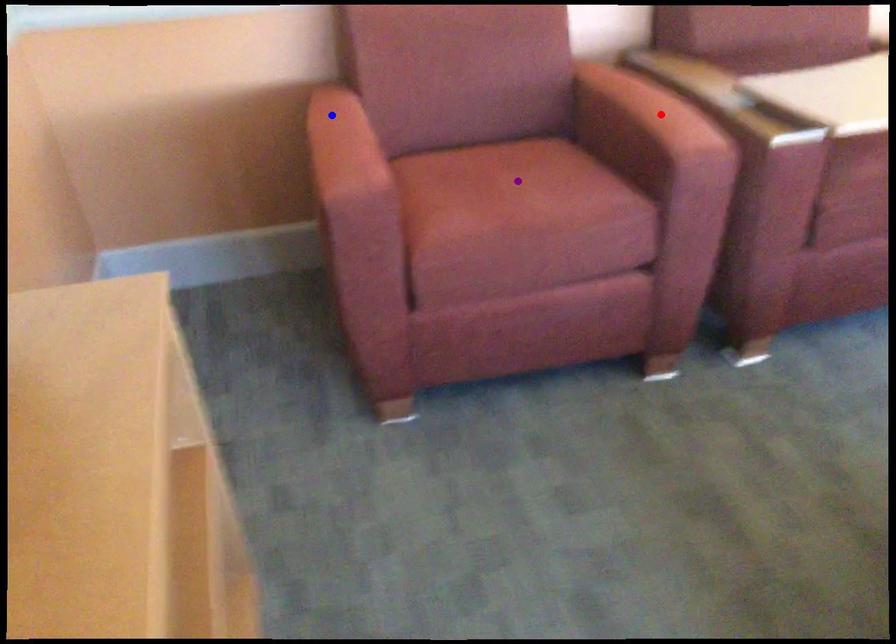
Order these from nearest to farthest:
- red point
- purple point
- blue point

red point
blue point
purple point